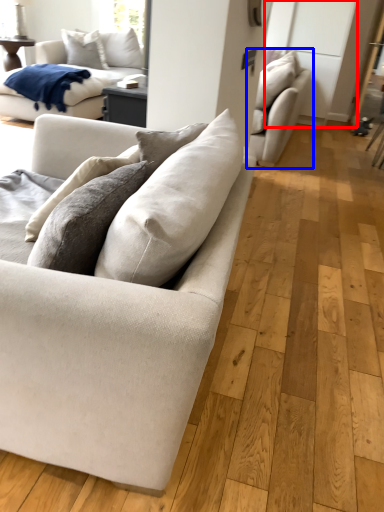
Question: Among these objects, which one is farthest to the camera, glass door (highlighted by a red box) or studio couch (highlighted by a blue box)?

Choices:
 (A) glass door
 (B) studio couch

Answer: (A)